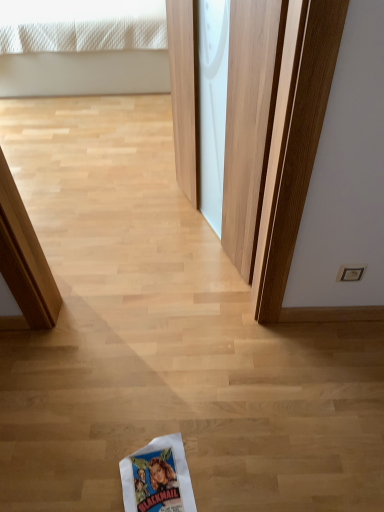
Question: Should I look upward or downward to see white fabric bed at upper left?

Choices:
 (A) up
 (B) down

Answer: (A)